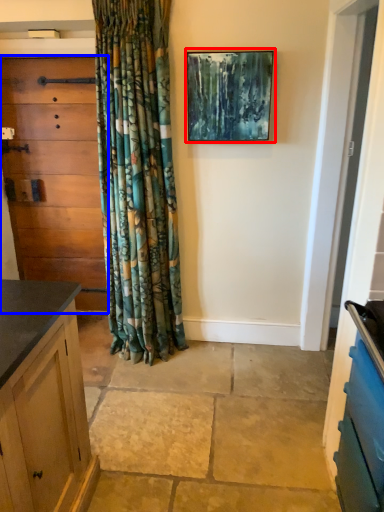
Question: Among these objects, which one is farthest to the camera, picture frame (highlighted by a red box) or chest of drawers (highlighted by a blue box)?

Choices:
 (A) picture frame
 (B) chest of drawers

Answer: (B)